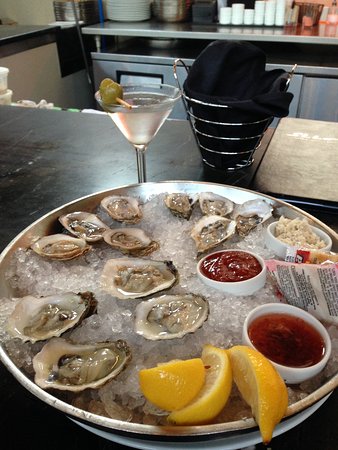
Find the location of a particular element. glass is located at coordinates tap(136, 122).